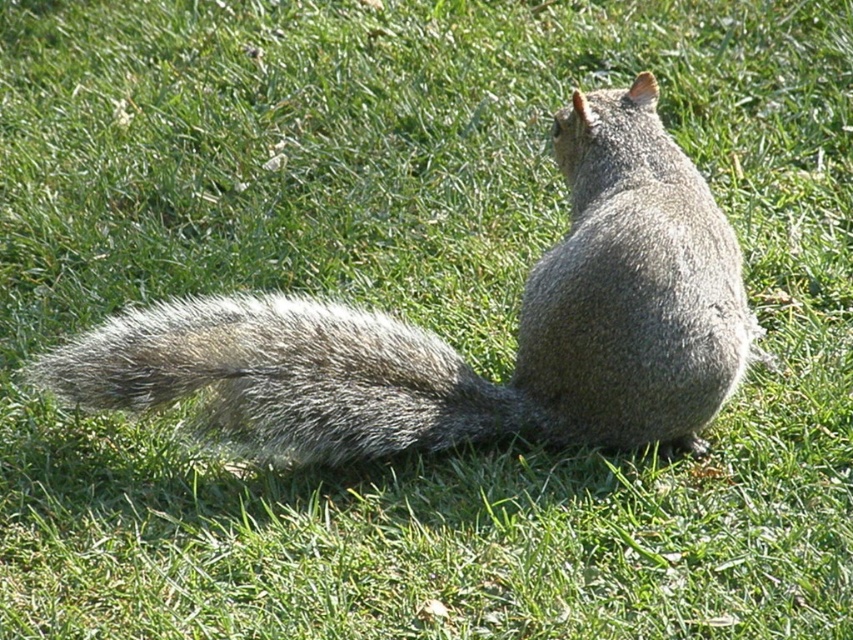
Question: Is gray furry squirrel at center in front of fuzzy gray tail at lower left?

Choices:
 (A) yes
 (B) no

Answer: (B)

Question: Is the position of gray furry squirrel at center less distant than that of fuzzy gray tail at lower left?

Choices:
 (A) yes
 (B) no

Answer: (B)

Question: Is gray furry squirrel at center closer to camera compared to fuzzy gray tail at lower left?

Choices:
 (A) yes
 (B) no

Answer: (B)

Question: Which point appears closest to the camera in this image?

Choices:
 (A) (73, 365)
 (B) (154, 316)

Answer: (A)